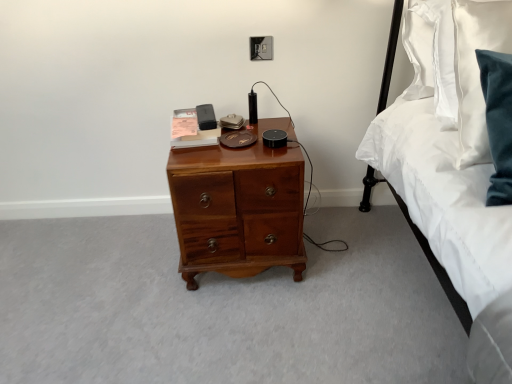
What do you see at coordinates (261, 48) in the screenshot? I see `black plastic electric outlet at upper center` at bounding box center [261, 48].

Looking at this image, what is the approximate width of white satin bed at right?

18.79 inches.

Describe the element at coordinates (238, 209) in the screenshot. I see `shiny brown wooden chest of drawers at center` at that location.

Find the location of a particular element. shiny brown wooden chest of drawers at center is located at coordinates (238, 209).

Where is `black plastic electric outlet at upper center`? black plastic electric outlet at upper center is located at coordinates (261, 48).

From the image's perspective, relative to shiny brown wooden chest of drawers at center, is black plastic electric outlet at upper center above or below?

black plastic electric outlet at upper center is situated higher than shiny brown wooden chest of drawers at center in the image.

Based on their positions, is black plastic electric outlet at upper center located to the left or right of shiny brown wooden chest of drawers at center?

Clearly, black plastic electric outlet at upper center is on the right of shiny brown wooden chest of drawers at center in the image.

Between black plastic electric outlet at upper center and shiny brown wooden chest of drawers at center, which one is positioned in front?

shiny brown wooden chest of drawers at center.

Which object is further away from the camera, shiny brown wooden chest of drawers at center or white satin bed at right?

shiny brown wooden chest of drawers at center is further away from the camera.

Could you tell me if shiny brown wooden chest of drawers at center is turned towards white satin bed at right?

No, shiny brown wooden chest of drawers at center is not oriented towards white satin bed at right.

Considering the relative sizes of shiny brown wooden chest of drawers at center and white satin bed at right in the image provided, is shiny brown wooden chest of drawers at center taller than white satin bed at right?

In fact, shiny brown wooden chest of drawers at center may be shorter than white satin bed at right.

Considering the points (477, 222) and (270, 48), which point is behind, point (477, 222) or point (270, 48)?

The point (270, 48) is farther from the camera.

Considering the positions of objects white satin bed at right and black plastic electric outlet at upper center in the image provided, who is more to the right, white satin bed at right or black plastic electric outlet at upper center?

Positioned to the right is white satin bed at right.

From a real-world perspective, is white satin bed at right positioned over black plastic electric outlet at upper center based on gravity?

Incorrect, from a real-world perspective, white satin bed at right is lower than black plastic electric outlet at upper center.

This screenshot has height=384, width=512. In order to click on electric outlet that is behind the white satin bed at right in this screenshot , I will do `click(261, 48)`.

Is shiny brown wooden chest of drawers at center to the left or to the right of black plastic electric outlet at upper center in the image?

Based on their positions, shiny brown wooden chest of drawers at center is located to the left of black plastic electric outlet at upper center.

From the picture: Is the surface of shiny brown wooden chest of drawers at center in direct contact with black plastic electric outlet at upper center?

No, shiny brown wooden chest of drawers at center is not touching black plastic electric outlet at upper center.

What's the angular difference between shiny brown wooden chest of drawers at center and black plastic electric outlet at upper center's facing directions?

The angular difference between shiny brown wooden chest of drawers at center and black plastic electric outlet at upper center is 1.76 degrees.

Considering the points (173, 191) and (272, 45), which point is behind, point (173, 191) or point (272, 45)?

The point (272, 45) is farther from the camera.

Is black plastic electric outlet at upper center positioned with its back to white satin bed at right?

black plastic electric outlet at upper center is not turned away from white satin bed at right.

Is black plastic electric outlet at upper center wider than white satin bed at right?

No.

Is black plastic electric outlet at upper center next to white satin bed at right and touching it?

No.

Considering the relative positions of white satin bed at right and shiny brown wooden chest of drawers at center in the image provided, is white satin bed at right behind shiny brown wooden chest of drawers at center?

No, white satin bed at right is in front of shiny brown wooden chest of drawers at center.

Based on the photo, who is taller, white satin bed at right or shiny brown wooden chest of drawers at center?

white satin bed at right is taller.

Consider the image. Would you say shiny brown wooden chest of drawers at center is part of white satin bed at right's contents?

No, shiny brown wooden chest of drawers at center is not surrounded by white satin bed at right.

In the scene shown: Is white satin bed at right placed right next to shiny brown wooden chest of drawers at center?

No, white satin bed at right is not making contact with shiny brown wooden chest of drawers at center.

Where is `chest of drawers that appears on the left of black plastic electric outlet at upper center`? This screenshot has height=384, width=512. chest of drawers that appears on the left of black plastic electric outlet at upper center is located at coordinates (238, 209).

You are a GUI agent. You are given a task and a screenshot of the screen. Output one action in this format:
    pyautogui.click(x=<x>, y=<y>)
    Task: Click on the chest of drawers below the white satin bed at right (from the image's perspective)
    This screenshot has width=512, height=384.
    Given the screenshot: What is the action you would take?
    pyautogui.click(x=238, y=209)

Looking at the image, which one is located closer to shiny brown wooden chest of drawers at center, black plastic electric outlet at upper center or white satin bed at right?

white satin bed at right.

Which object lies further to the anchor point white satin bed at right, shiny brown wooden chest of drawers at center or black plastic electric outlet at upper center?

black plastic electric outlet at upper center lies further to white satin bed at right than the other object.

Based on their spatial positions, is white satin bed at right or shiny brown wooden chest of drawers at center further from black plastic electric outlet at upper center?

white satin bed at right is further to black plastic electric outlet at upper center.

When comparing their distances from shiny brown wooden chest of drawers at center, does white satin bed at right or black plastic electric outlet at upper center seem further?

Based on the image, black plastic electric outlet at upper center appears to be further to shiny brown wooden chest of drawers at center.

Looking at the image, which one is located closer to black plastic electric outlet at upper center, shiny brown wooden chest of drawers at center or white satin bed at right?

The object closer to black plastic electric outlet at upper center is shiny brown wooden chest of drawers at center.

When comparing their distances from white satin bed at right, does black plastic electric outlet at upper center or shiny brown wooden chest of drawers at center seem further?

Based on the image, black plastic electric outlet at upper center appears to be further to white satin bed at right.

Where is `electric outlet between shiny brown wooden chest of drawers at center and white satin bed at right from left to right`? This screenshot has width=512, height=384. electric outlet between shiny brown wooden chest of drawers at center and white satin bed at right from left to right is located at coordinates (261, 48).